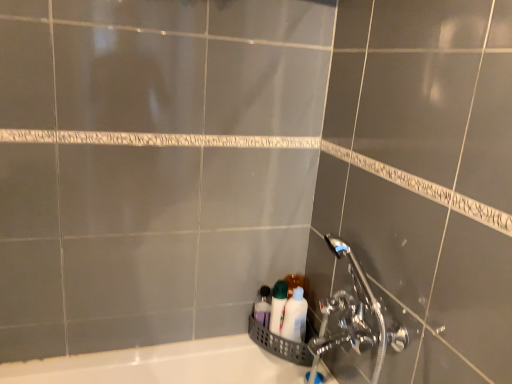
Question: Is translucent plastic bottles at lower center, which ranks as the 2th toiletry in right-to-left order, next to white glossy bottles at lower right, the second toiletry positioned from the left?

Choices:
 (A) no
 (B) yes

Answer: (B)

Question: From a real-world perspective, is translucent plastic bottles at lower center, marked as the 1th toiletry in a left-to-right arrangement, positioned under white glossy bottles at lower right, which ranks as the first toiletry in right-to-left order, based on gravity?

Choices:
 (A) yes
 (B) no

Answer: (A)

Question: Is translucent plastic bottles at lower center, marked as the 1th toiletry in a left-to-right arrangement, to the right of white glossy bottles at lower right, which ranks as the first toiletry in right-to-left order, from the viewer's perspective?

Choices:
 (A) yes
 (B) no

Answer: (B)

Question: From a real-world perspective, is translucent plastic bottles at lower center, which ranks as the 2th toiletry in right-to-left order, physically above white glossy bottles at lower right, which ranks as the first toiletry in right-to-left order?

Choices:
 (A) yes
 (B) no

Answer: (B)

Question: Is translucent plastic bottles at lower center, which ranks as the 2th toiletry in right-to-left order, shorter than white glossy bottles at lower right, the second toiletry positioned from the left?

Choices:
 (A) no
 (B) yes

Answer: (B)

Question: Is translucent plastic bottles at lower center, which ranks as the 2th toiletry in right-to-left order, facing away from white glossy bottles at lower right, the second toiletry positioned from the left?

Choices:
 (A) no
 (B) yes

Answer: (A)

Question: Does white glossy bottles at lower right, the second toiletry positioned from the left, have a larger size compared to translucent plastic bottles at lower center, which ranks as the 2th toiletry in right-to-left order?

Choices:
 (A) yes
 (B) no

Answer: (A)

Question: Is translucent plastic bottles at lower center, which ranks as the 2th toiletry in right-to-left order, at the back of white glossy bottles at lower right, which ranks as the first toiletry in right-to-left order?

Choices:
 (A) yes
 (B) no

Answer: (B)

Question: Considering the relative sizes of white glossy bottles at lower right, which ranks as the first toiletry in right-to-left order, and translucent plastic bottles at lower center, marked as the 1th toiletry in a left-to-right arrangement, in the image provided, is white glossy bottles at lower right, which ranks as the first toiletry in right-to-left order, shorter than translucent plastic bottles at lower center, marked as the 1th toiletry in a left-to-right arrangement,?

Choices:
 (A) no
 (B) yes

Answer: (A)

Question: Is white glossy bottles at lower right, which ranks as the first toiletry in right-to-left order, at the right side of translucent plastic bottles at lower center, which ranks as the 2th toiletry in right-to-left order?

Choices:
 (A) yes
 (B) no

Answer: (A)

Question: Is white glossy bottles at lower right, the second toiletry positioned from the left, in contact with translucent plastic bottles at lower center, which ranks as the 2th toiletry in right-to-left order?

Choices:
 (A) yes
 (B) no

Answer: (A)

Question: Is white glossy bottles at lower right, which ranks as the first toiletry in right-to-left order, taller than translucent plastic bottles at lower center, marked as the 1th toiletry in a left-to-right arrangement?

Choices:
 (A) no
 (B) yes

Answer: (B)

Question: Considering the positions of translucent plastic bottles at lower center, which ranks as the 2th toiletry in right-to-left order, and white glossy bottles at lower right, the second toiletry positioned from the left, in the image, is translucent plastic bottles at lower center, which ranks as the 2th toiletry in right-to-left order, bigger or smaller than white glossy bottles at lower right, the second toiletry positioned from the left,?

Choices:
 (A) small
 (B) big

Answer: (A)